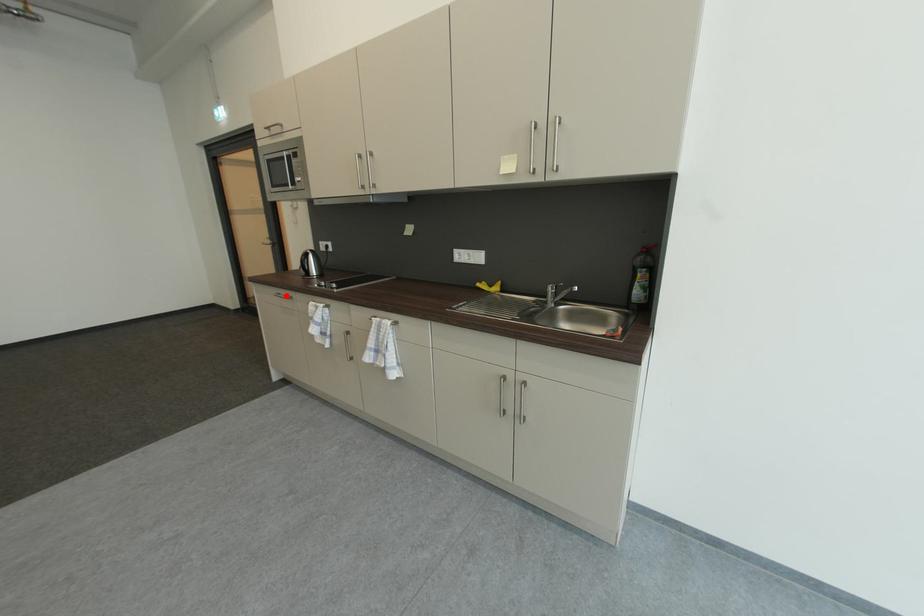
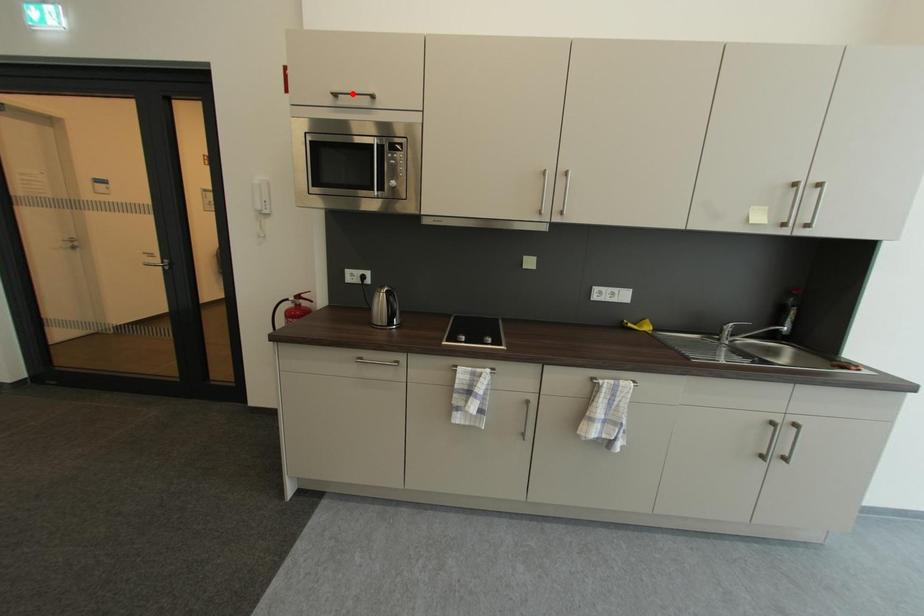
I am providing you with two images of the same scene from different viewpoints. A red point is marked on the first image and another point is marked on the second image. Is the red point in image1 aligned with the point shown in image2?

No